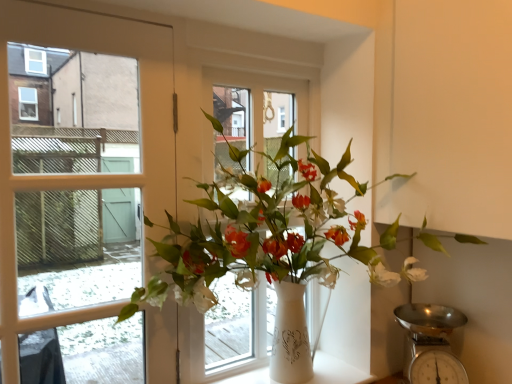
Question: Is white plastic window frame at center located within metallic silver scale at lower right?

Choices:
 (A) yes
 (B) no

Answer: (B)

Question: Is metallic silver scale at lower right closer to the viewer compared to white plastic window frame at center?

Choices:
 (A) yes
 (B) no

Answer: (A)

Question: Could you tell me if metallic silver scale at lower right is facing white plastic window frame at center?

Choices:
 (A) no
 (B) yes

Answer: (A)

Question: Can you confirm if metallic silver scale at lower right is taller than white plastic window frame at center?

Choices:
 (A) no
 (B) yes

Answer: (A)

Question: Is metallic silver scale at lower right at the right side of white plastic window frame at center?

Choices:
 (A) no
 (B) yes

Answer: (B)

Question: Considering the relative sizes of metallic silver scale at lower right and white plastic window frame at center in the image provided, is metallic silver scale at lower right smaller than white plastic window frame at center?

Choices:
 (A) yes
 (B) no

Answer: (A)

Question: From a real-world perspective, is metallic silver scale at lower right physically below white ceramic vase at center?

Choices:
 (A) no
 (B) yes

Answer: (A)

Question: Considering the relative sizes of metallic silver scale at lower right and white ceramic vase at center in the image provided, is metallic silver scale at lower right taller than white ceramic vase at center?

Choices:
 (A) yes
 (B) no

Answer: (A)

Question: Considering the relative sizes of metallic silver scale at lower right and white ceramic vase at center in the image provided, is metallic silver scale at lower right thinner than white ceramic vase at center?

Choices:
 (A) no
 (B) yes

Answer: (B)

Question: Is metallic silver scale at lower right further to the viewer compared to white ceramic vase at center?

Choices:
 (A) yes
 (B) no

Answer: (A)

Question: Does metallic silver scale at lower right have a lesser height compared to white ceramic vase at center?

Choices:
 (A) yes
 (B) no

Answer: (B)

Question: Can you confirm if metallic silver scale at lower right is positioned to the left of white ceramic vase at center?

Choices:
 (A) yes
 (B) no

Answer: (B)

Question: Can you confirm if metallic silver scale at lower right is positioned to the left of white glossy vase at center?

Choices:
 (A) yes
 (B) no

Answer: (B)